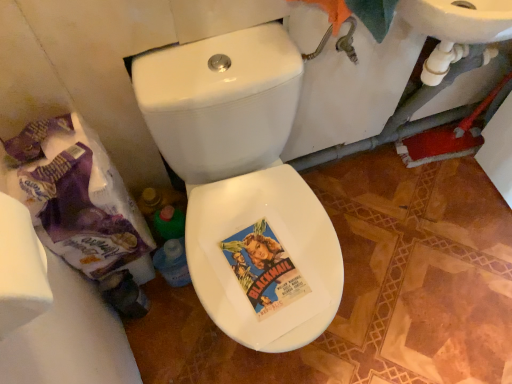
Question: Does white glossy bidet at center turn towards white glossy toilet at center?

Choices:
 (A) yes
 (B) no

Answer: (A)

Question: Is white glossy bidet at center in front of white glossy toilet at center?

Choices:
 (A) yes
 (B) no

Answer: (B)

Question: Can you confirm if white glossy bidet at center is wider than white glossy toilet at center?

Choices:
 (A) no
 (B) yes

Answer: (A)

Question: Is white glossy bidet at center outside white glossy toilet at center?

Choices:
 (A) yes
 (B) no

Answer: (B)

Question: Considering the relative positions of white glossy bidet at center and white glossy toilet at center in the image provided, is white glossy bidet at center to the left of white glossy toilet at center from the viewer's perspective?

Choices:
 (A) yes
 (B) no

Answer: (B)

Question: Is white glossy bidet at center far away from white glossy toilet at center?

Choices:
 (A) yes
 (B) no

Answer: (B)

Question: From a real-world perspective, is white glossy toilet at center physically below white glossy bidet at center?

Choices:
 (A) no
 (B) yes

Answer: (B)

Question: From a real-world perspective, is white glossy toilet at center located higher than white glossy bidet at center?

Choices:
 (A) no
 (B) yes

Answer: (A)

Question: Is white glossy toilet at center oriented away from white glossy bidet at center?

Choices:
 (A) yes
 (B) no

Answer: (A)

Question: Is white glossy toilet at center positioned in front of white glossy bidet at center?

Choices:
 (A) no
 (B) yes

Answer: (B)

Question: Is white glossy toilet at center next to white glossy bidet at center?

Choices:
 (A) yes
 (B) no

Answer: (A)

Question: Considering the relative sizes of white glossy toilet at center and white glossy bidet at center in the image provided, is white glossy toilet at center shorter than white glossy bidet at center?

Choices:
 (A) no
 (B) yes

Answer: (A)

Question: Considering the relative sizes of white matte toilet paper at left and white glossy toilet at center in the image provided, is white matte toilet paper at left bigger than white glossy toilet at center?

Choices:
 (A) yes
 (B) no

Answer: (B)